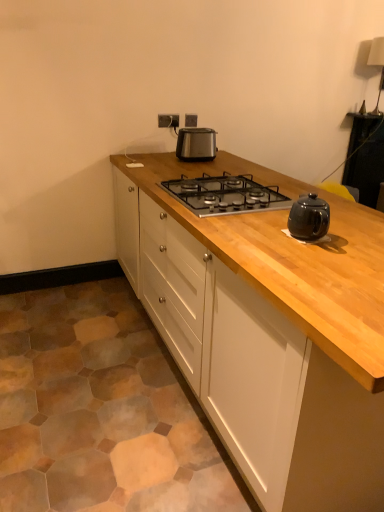
Identify the location of free location in front of satin black toaster at center. Image resolution: width=384 pixels, height=512 pixels. (198, 162).